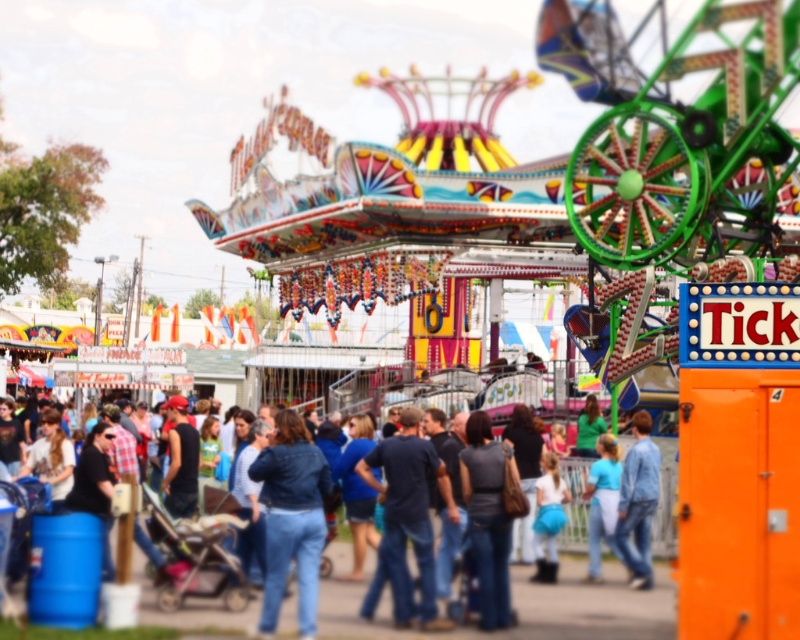
Measure the distance between jeans at center and camera.

jeans at center and camera are 62.20 meters apart from each other.

Does point (602, 624) lie in front of point (424, 513)?

Yes, it is in front of point (424, 513).

Which is in front, point (240, 612) or point (414, 465)?

Positioned in front is point (240, 612).

Locate an element on the screen. jeans at center is located at coordinates (590, 604).

Does point (514, 572) come in front of point (276, 522)?

No, it is not.

Between point (512, 572) and point (322, 458), which one is positioned in front?

Point (322, 458) is more forward.

Which is behind, point (389, 605) or point (284, 506)?

The point (284, 506) is more distant.

Image resolution: width=800 pixels, height=640 pixels. What are the coordinates of `jeans at center` in the screenshot? It's located at (590, 604).

Who is more forward, [618,628] or [496,451]?

Positioned in front is point [618,628].

Who is positioned more to the right, jeans at center or dark gray fabric shirt at center?

dark gray fabric shirt at center

The image size is (800, 640). What are the coordinates of `jeans at center` in the screenshot? It's located at (590, 604).